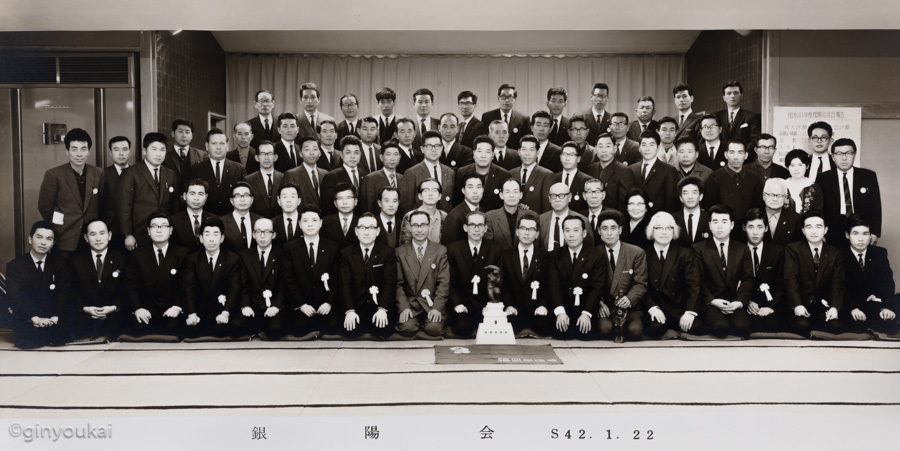
You are a GUI agent. You are given a task and a screenshot of the screen. Output one action in this format:
    pyautogui.click(x=<x>, y=<y>)
    Task: Click on the vent
    The width and height of the screenshot is (900, 451).
    Given the screenshot: What is the action you would take?
    pyautogui.click(x=102, y=78), pyautogui.click(x=15, y=70)